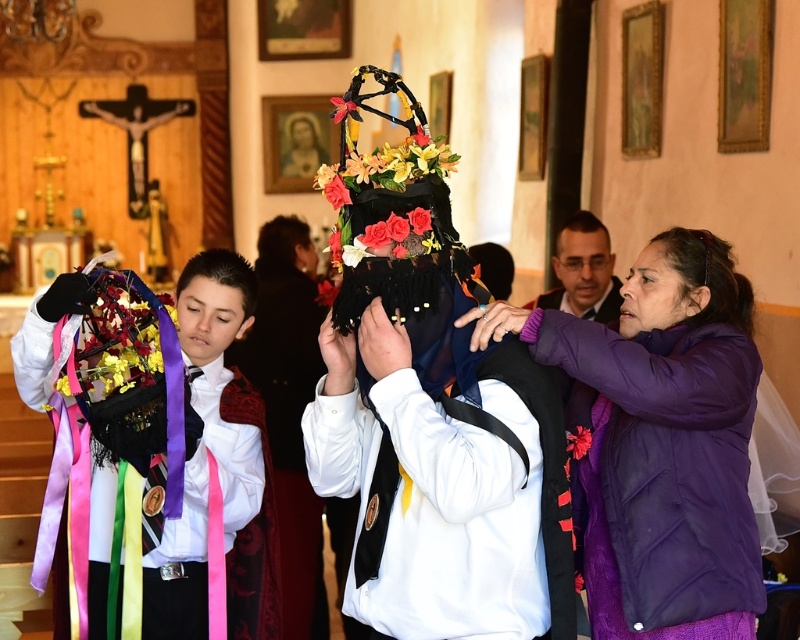
You are standing in the church and want to find the purple soft jacket at center. According to the coordinates given, where should you look relative to the center of the image?

The purple soft jacket at center is located at coordinates approximately 44.5 percent to the right and 85.6 percent down from the top left corner of the image.

You are standing in the church and want to hand a bouquet to the person wearing the purple soft jacket at center. Which direction should you walk to reach them first without passing the matte black hair at left?

The purple soft jacket at center is closer to the viewer than the matte black hair at left, so you should walk forward towards the purple soft jacket at center directly.